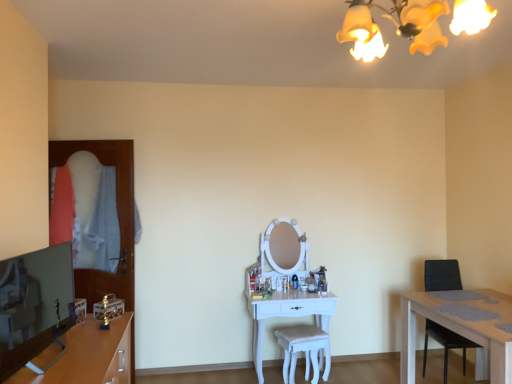
Question: Would you say white glossy vanity at center is a long distance from black leather chair at right?

Choices:
 (A) no
 (B) yes

Answer: (B)

Question: Is white glossy vanity at center turned away from black leather chair at right?

Choices:
 (A) no
 (B) yes

Answer: (A)

Question: Is black leather chair at right located within white glossy vanity at center?

Choices:
 (A) yes
 (B) no

Answer: (B)

Question: From a real-world perspective, is white glossy vanity at center located higher than black leather chair at right?

Choices:
 (A) yes
 (B) no

Answer: (B)

Question: Can you confirm if white glossy vanity at center is positioned to the right of black leather chair at right?

Choices:
 (A) no
 (B) yes

Answer: (A)

Question: Considering the relative sizes of white glossy vanity at center and black leather chair at right in the image provided, is white glossy vanity at center smaller than black leather chair at right?

Choices:
 (A) yes
 (B) no

Answer: (B)

Question: Can you confirm if black leather chair at right is taller than white glossy vanity at center?

Choices:
 (A) no
 (B) yes

Answer: (B)

Question: From a real-world perspective, is black leather chair at right located beneath white glossy vanity at center?

Choices:
 (A) no
 (B) yes

Answer: (A)

Question: From the image's perspective, is black leather chair at right on top of white glossy vanity at center?

Choices:
 (A) yes
 (B) no

Answer: (A)

Question: Can you confirm if black leather chair at right is wider than white glossy vanity at center?

Choices:
 (A) no
 (B) yes

Answer: (B)

Question: Would you say black leather chair at right contains white glossy vanity at center?

Choices:
 (A) no
 (B) yes

Answer: (A)

Question: Does black leather chair at right turn towards white glossy vanity at center?

Choices:
 (A) no
 (B) yes

Answer: (A)

Question: Can you confirm if black leather chair at right is positioned to the right of white fabric stool at center?

Choices:
 (A) yes
 (B) no

Answer: (A)